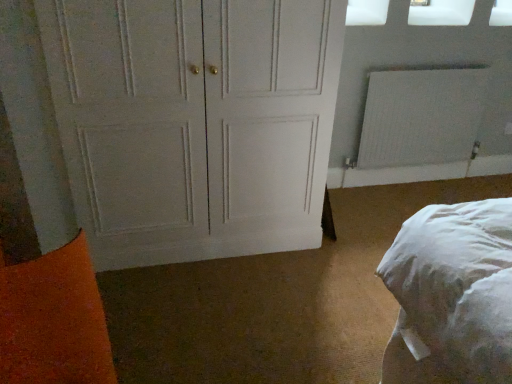
You are a GUI agent. You are given a task and a screenshot of the screen. Output one action in this format:
    pyautogui.click(x=<x>, y=<y>)
    Task: Click on the free point in front of white painted wood door at center
    The height and width of the screenshot is (384, 512).
    Given the screenshot: What is the action you would take?
    pyautogui.click(x=220, y=309)